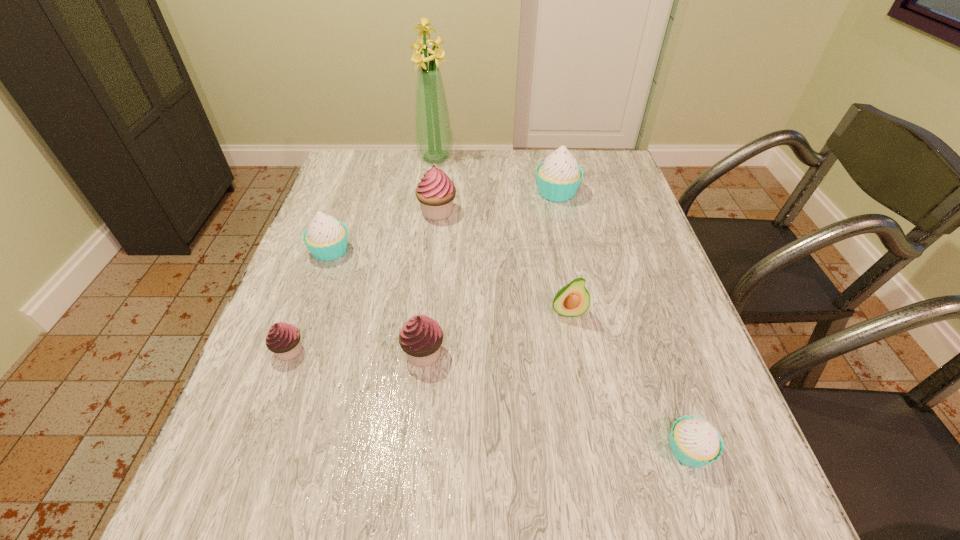
At what (x,y) coordinates should I click in order to perform the action: click on the tallest object. Please return your answer as a coordinate pair (x, y). Looking at the image, I should click on (433, 132).

You are a GUI agent. You are given a task and a screenshot of the screen. Output one action in this format:
    pyautogui.click(x=<x>, y=<y>)
    Task: Click on the farthest object
    
    Given the screenshot: What is the action you would take?
    pyautogui.click(x=433, y=132)

Where is `the second cupcake from right to left`? The width and height of the screenshot is (960, 540). the second cupcake from right to left is located at coordinates (558, 178).

Where is `the second white cupcake from right to left`? This screenshot has width=960, height=540. the second white cupcake from right to left is located at coordinates (558, 178).

Find the location of a particular element. The width and height of the screenshot is (960, 540). the biggest pink cupcake is located at coordinates (436, 191).

Locate an element on the screen. the fifth nearest object is located at coordinates (326, 238).

Identify the location of the fourth nearest cupcake. The height and width of the screenshot is (540, 960). (326, 238).

The image size is (960, 540). In order to click on the second biggest pink cupcake in this screenshot , I will do `click(421, 337)`.

Find the location of a particular element. The width and height of the screenshot is (960, 540). avocado is located at coordinates (573, 300).

I want to click on the fifth farthest object, so (x=573, y=300).